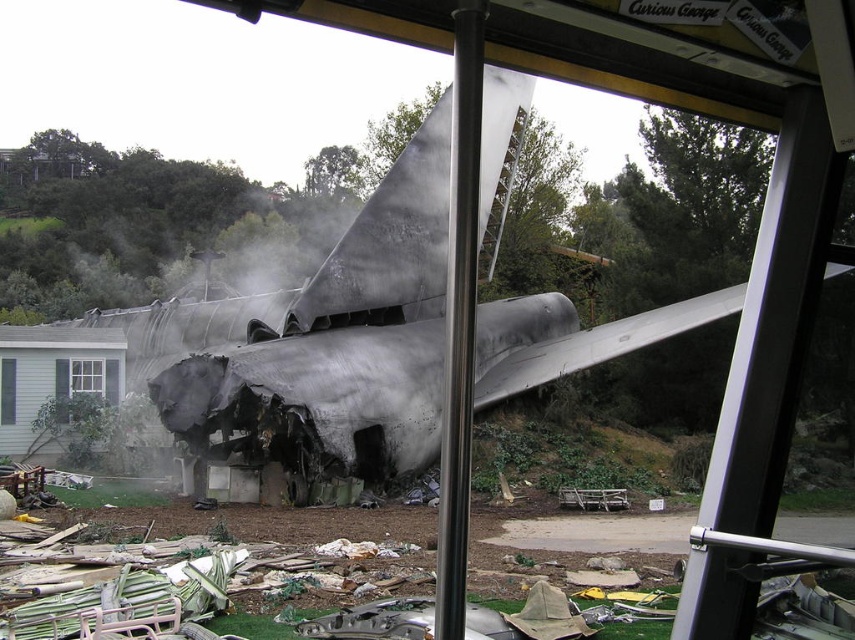
Looking at this image, is gray wood window at lower left positioned in front of white plastic window at lower left?

No, gray wood window at lower left is behind white plastic window at lower left.

Locate an element on the screen. This screenshot has height=640, width=855. gray wood window at lower left is located at coordinates (86, 387).

The image size is (855, 640). What do you see at coordinates (86, 387) in the screenshot?
I see `gray wood window at lower left` at bounding box center [86, 387].

The width and height of the screenshot is (855, 640). In order to click on gray wood window at lower left in this screenshot , I will do `click(86, 387)`.